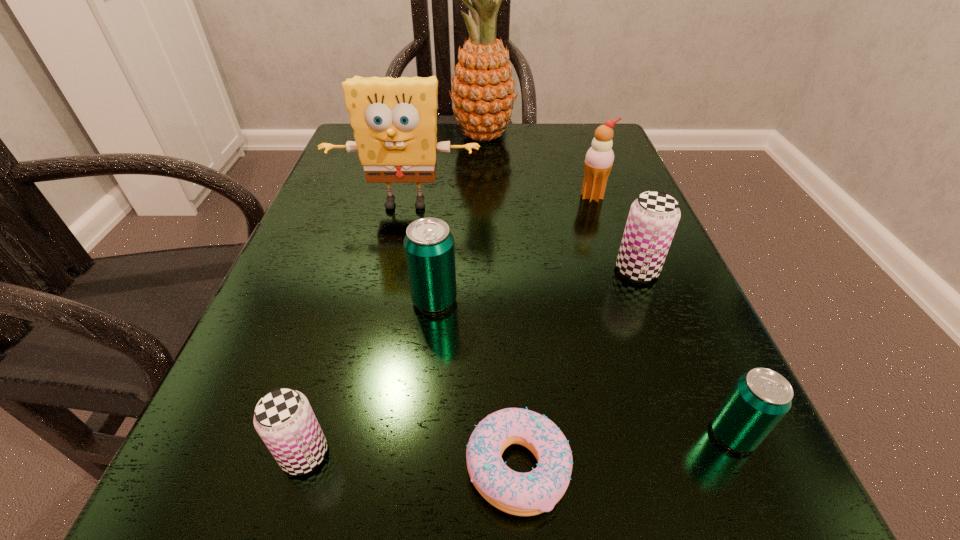
Find the location of a particular element. This screenshot has width=960, height=540. free space between the sixth shortest object and the shortest object is located at coordinates (555, 332).

Locate an element on the screen. This screenshot has width=960, height=540. free space that is in between the shortest object and the bigger teal beer can is located at coordinates (476, 383).

At what (x,y) coordinates should I click in order to perform the action: click on free point between the third tallest object and the purple doughnut. Please return your answer as a coordinate pair (x, y). Looking at the image, I should click on (555, 332).

At what (x,y) coordinates should I click in order to perform the action: click on vacant area that lies between the farther teal beer can and the right purple beer can. Please return your answer as a coordinate pair (x, y). This screenshot has width=960, height=540. Looking at the image, I should click on pos(536,285).

Identify which object is the third nearest to the doughnut. Please provide its 2D coordinates. Your answer should be formatted as a tuple, i.e. [(x, y)], where the tuple contains the x and y coordinates of a point satisfying the conditions above.

[(759, 399)]

Identify which object is located as the fifth nearest to the farthest object. Please provide its 2D coordinates. Your answer should be formatted as a tuple, i.e. [(x, y)], where the tuple contains the x and y coordinates of a point satisfying the conditions above.

[(522, 494)]

Identify which beer can is located as the second nearest to the smaller teal beer can. Please provide its 2D coordinates. Your answer should be formatted as a tuple, i.e. [(x, y)], where the tuple contains the x and y coordinates of a point satisfying the conditions above.

[(429, 248)]

You are a GUI agent. You are given a task and a screenshot of the screen. Output one action in this format:
    pyautogui.click(x=<x>, y=<y>)
    Task: Click on the second closest beer can to the farther purple beer can
    
    Given the screenshot: What is the action you would take?
    pyautogui.click(x=429, y=248)

Where is `free space that satisfies the following two spatial constraints: 1. on the front side of the right teal beer can; 2. on the left side of the tallest object`? free space that satisfies the following two spatial constraints: 1. on the front side of the right teal beer can; 2. on the left side of the tallest object is located at coordinates (487, 434).

The width and height of the screenshot is (960, 540). I want to click on free location that satisfies the following two spatial constraints: 1. on the face of the bigger purple beer can; 2. on the left side of the seventh shortest object, so click(392, 270).